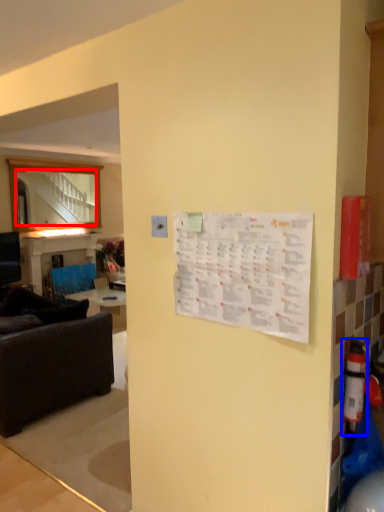
Question: Which of the following is the closest to the observer, mirror (highlighted by a red box) or extinguisher (highlighted by a blue box)?

Choices:
 (A) mirror
 (B) extinguisher

Answer: (B)